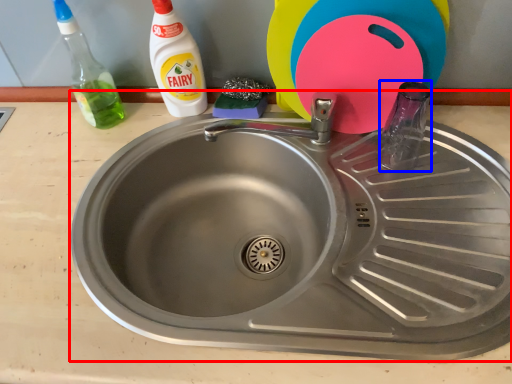
Question: Among these objects, which one is farthest to the camera, sink (highlighted by a red box) or bottle (highlighted by a blue box)?

Choices:
 (A) sink
 (B) bottle

Answer: (B)